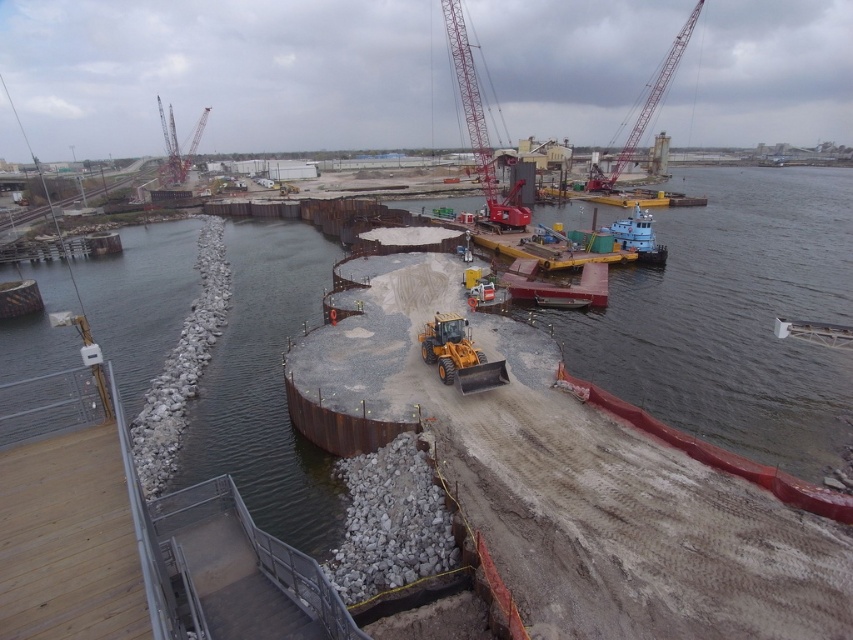
Question: Is yellow rubber at center closer to camera compared to red metallic crane at upper left?

Choices:
 (A) no
 (B) yes

Answer: (B)

Question: Among these objects, which one is farthest from the camera?

Choices:
 (A) metallic gray crane at upper right
 (B) red metallic crane at upper center
 (C) red metallic crane at upper left
 (D) yellow rubber at center

Answer: (C)

Question: Which point is closer to the camera?

Choices:
 (A) metallic gray crane at upper right
 (B) red metallic crane at upper left
 (C) yellow rubber at center

Answer: (C)

Question: Which object is positioned closest to the red metallic crane at upper left?

Choices:
 (A) metallic gray crane at upper right
 (B) yellow rubber at center

Answer: (A)

Question: Is yellow rubber at center wider than red metallic crane at upper left?

Choices:
 (A) no
 (B) yes

Answer: (A)

Question: Is metallic gray crane at upper right to the right of red metallic crane at upper left from the viewer's perspective?

Choices:
 (A) yes
 (B) no

Answer: (A)